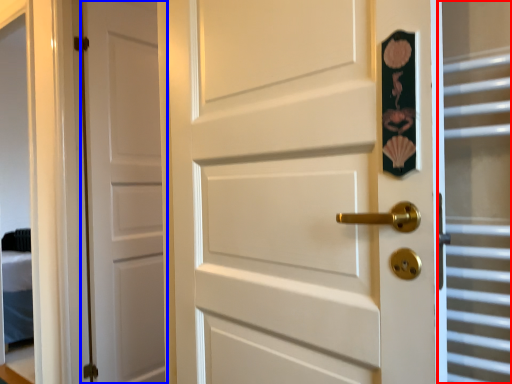
Question: Among these objects, which one is farthest to the camera, glass door (highlighted by a red box) or door (highlighted by a blue box)?

Choices:
 (A) glass door
 (B) door

Answer: (B)